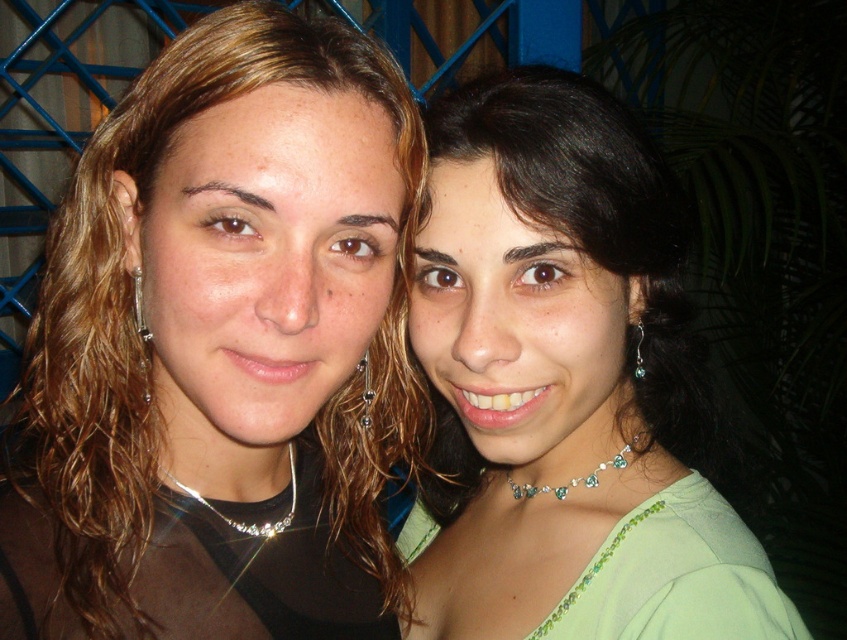
Question: Can you confirm if emerald crystal necklace at center is positioned below silver metallic earring at left?

Choices:
 (A) no
 (B) yes

Answer: (B)

Question: Does silver metallic earring at center have a greater width compared to green crystal earring at right?

Choices:
 (A) yes
 (B) no

Answer: (B)

Question: Which point appears farthest from the camera in this image?

Choices:
 (A) (65, 204)
 (B) (366, 378)

Answer: (B)

Question: Which of the following is the farthest from the observer?

Choices:
 (A) (364, 406)
 (B) (629, 445)
 (C) (635, 358)
 (D) (244, 531)

Answer: (C)

Question: Which point is closer to the camera?

Choices:
 (A) brown shiny hair at center
 (B) silver metallic earring at left
 (C) silver/glass necklace at left

Answer: (A)

Question: Is emerald crystal necklace at center further to camera compared to green crystal earring at right?

Choices:
 (A) yes
 (B) no

Answer: (A)